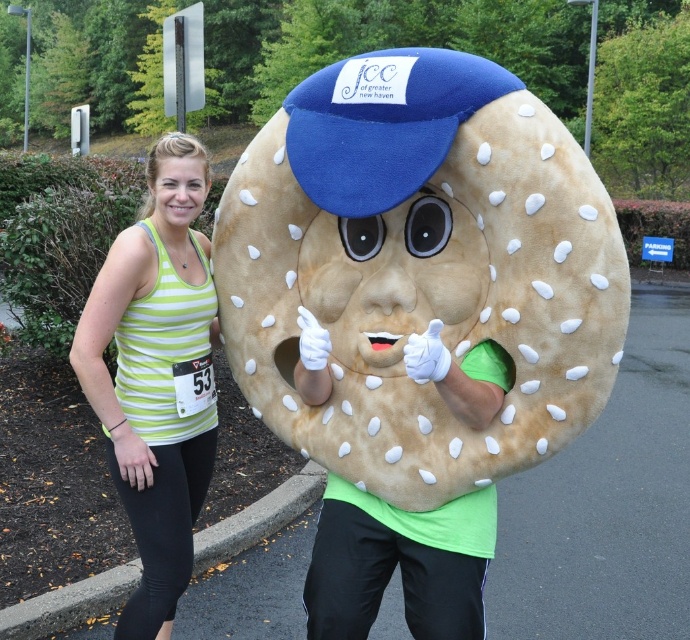
Question: Which of the following is the farthest from the observer?

Choices:
 (A) green striped tank top at center
 (B) brown plush bagel at center

Answer: (A)

Question: From the image, what is the correct spatial relationship of brown plush bagel at center in relation to green striped tank top at center?

Choices:
 (A) below
 (B) above

Answer: (B)

Question: Among these points, which one is farthest from the camera?

Choices:
 (A) (364, 157)
 (B) (168, 621)

Answer: (B)

Question: Does brown plush bagel at center have a greater width compared to green striped tank top at center?

Choices:
 (A) no
 (B) yes

Answer: (B)

Question: Observing the image, what is the correct spatial positioning of brown plush bagel at center in reference to green striped tank top at center?

Choices:
 (A) below
 (B) above

Answer: (B)